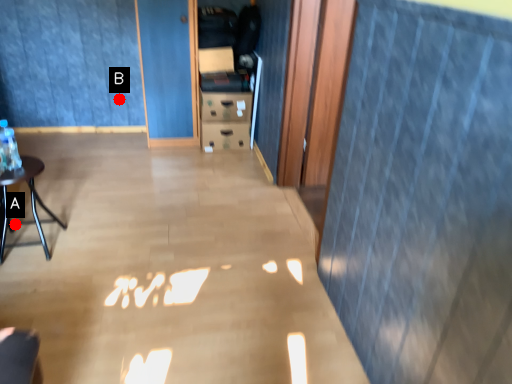
Question: Two points are circled on the image, labeled by A and B beside each circle. Which point is closer to the camera?

Choices:
 (A) A is closer
 (B) B is closer

Answer: (A)